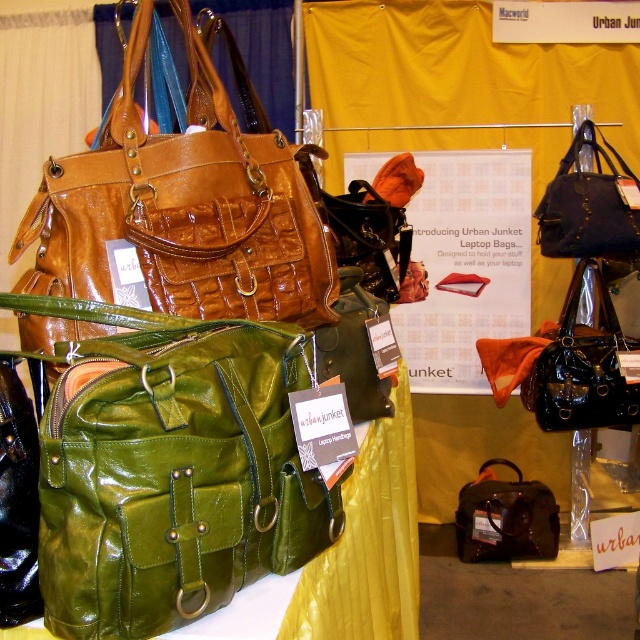
Question: In this image, where is green leather bag at center located relative to matte black bag at upper right?

Choices:
 (A) left
 (B) right

Answer: (A)

Question: Which object is closer to the camera taking this photo?

Choices:
 (A) matte black bag at upper right
 (B) green leather bag at left
 (C) green leather bag at center

Answer: (C)

Question: Does green leather bag at left appear under matte black bag at upper right?

Choices:
 (A) no
 (B) yes

Answer: (B)

Question: Which point is farther from the camera taking this photo?

Choices:
 (A) (592, 220)
 (B) (272, 186)

Answer: (A)

Question: Can you confirm if green leather bag at left is smaller than matte white paper at center?

Choices:
 (A) yes
 (B) no

Answer: (A)

Question: Which object is farther from the camera taking this photo?

Choices:
 (A) green leather bag at center
 (B) black leather bag at center
 (C) green leather bag at left
 (D) matte black bag at upper right

Answer: (B)